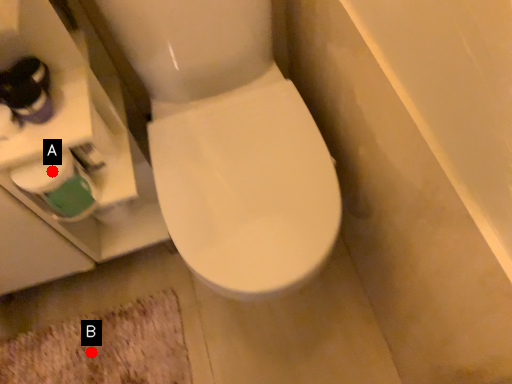
Question: Two points are circled on the image, labeled by A and B beside each circle. Which of the following is the farthest from the observer?

Choices:
 (A) A is further
 (B) B is further

Answer: (B)